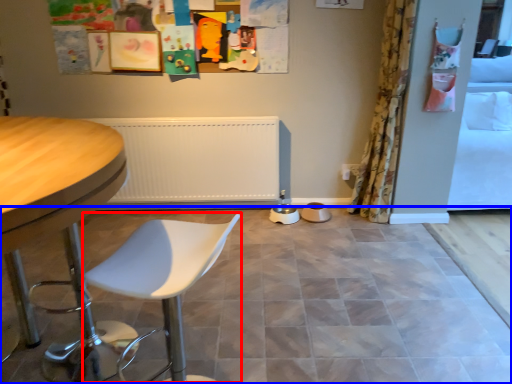
Question: Which object is closer to the camera taking this photo, swivel chair (highlighted by a red box) or ceramic tile (highlighted by a blue box)?

Choices:
 (A) swivel chair
 (B) ceramic tile

Answer: (A)